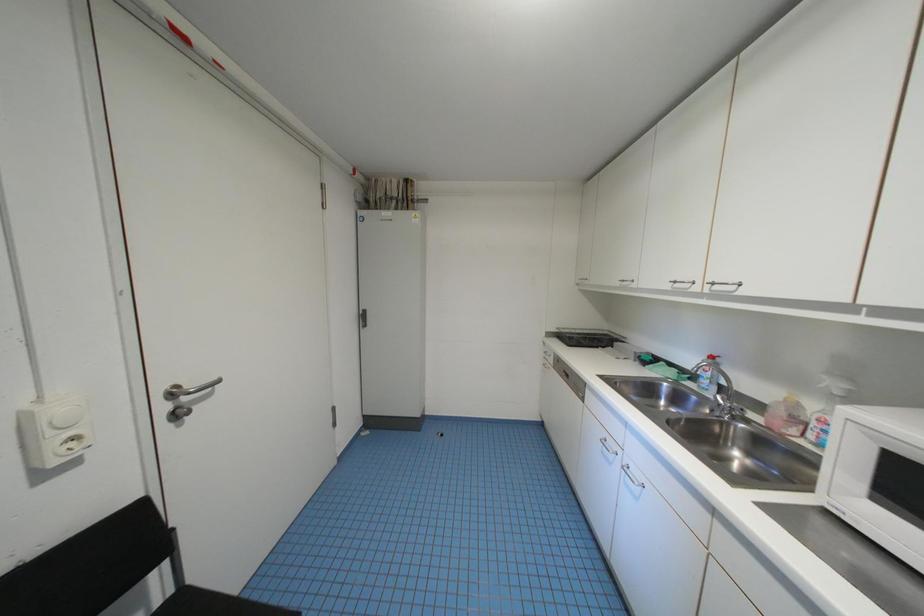
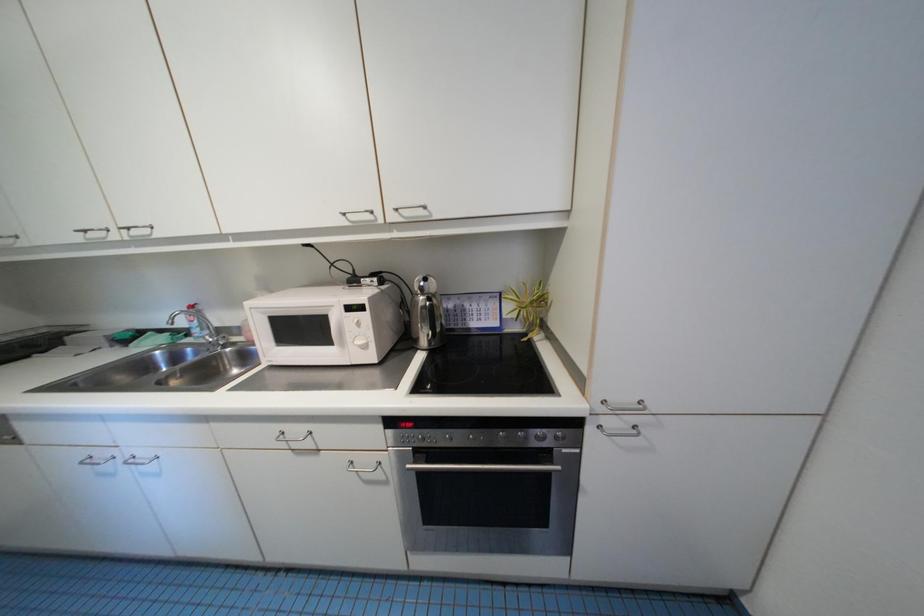
From the picture: The images are taken continuously from a first-person perspective. In which direction is your viewpoint rotating?

The camera's rotation is toward right-down.